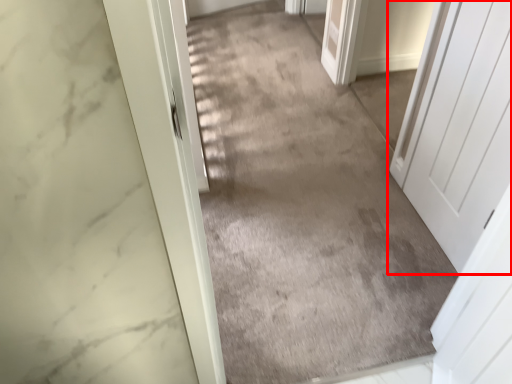
Question: Observing the image, what is the correct spatial positioning of door (annotated by the red box) in reference to path?

Choices:
 (A) right
 (B) left

Answer: (A)